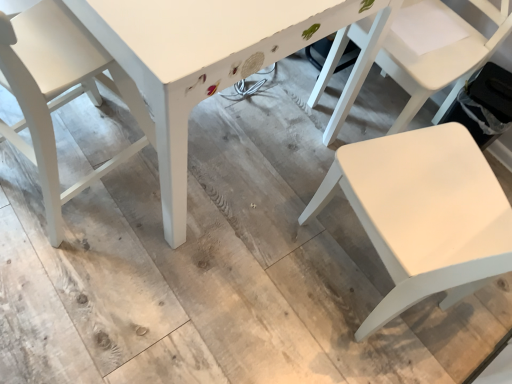
At what (x,y) coordinates should I click in order to perform the action: click on vacant space positioned to the left of white matte chair at lower right, which is the 2th chair from left to right. Please return your answer as a coordinate pair (x, y). Looking at the image, I should click on (250, 263).